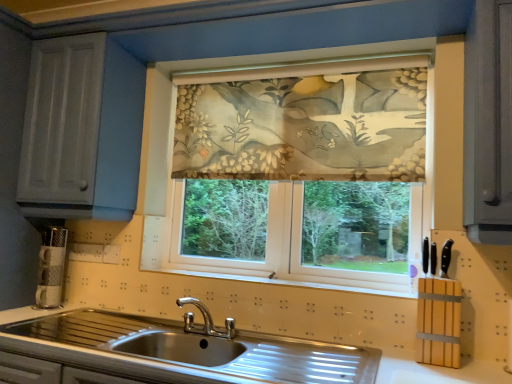
Question: Is floral fabric curtain at center not near floral fabric at center?

Choices:
 (A) no
 (B) yes

Answer: (A)

Question: From the image's perspective, does floral fabric curtain at center appear lower than floral fabric at center?

Choices:
 (A) yes
 (B) no

Answer: (B)

Question: Is floral fabric curtain at center aimed at floral fabric at center?

Choices:
 (A) yes
 (B) no

Answer: (A)

Question: Is floral fabric curtain at center in front of floral fabric at center?

Choices:
 (A) yes
 (B) no

Answer: (B)

Question: From the image's perspective, is floral fabric curtain at center on floral fabric at center?

Choices:
 (A) no
 (B) yes

Answer: (B)

Question: Is floral fabric curtain at center wider than floral fabric at center?

Choices:
 (A) yes
 (B) no

Answer: (B)

Question: Is stainless steel sink at lower center completely or partially outside of floral fabric at center?

Choices:
 (A) no
 (B) yes

Answer: (B)

Question: Considering the relative sizes of stainless steel sink at lower center and floral fabric at center in the image provided, is stainless steel sink at lower center wider than floral fabric at center?

Choices:
 (A) no
 (B) yes

Answer: (B)

Question: Is stainless steel sink at lower center at the right side of floral fabric at center?

Choices:
 (A) yes
 (B) no

Answer: (B)

Question: Could you tell me if stainless steel sink at lower center is turned towards floral fabric at center?

Choices:
 (A) no
 (B) yes

Answer: (A)

Question: Is stainless steel sink at lower center shorter than floral fabric at center?

Choices:
 (A) no
 (B) yes

Answer: (B)

Question: From the image's perspective, does stainless steel sink at lower center appear lower than floral fabric at center?

Choices:
 (A) no
 (B) yes

Answer: (B)

Question: Is floral fabric at center shorter than floral fabric curtain at center?

Choices:
 (A) no
 (B) yes

Answer: (A)